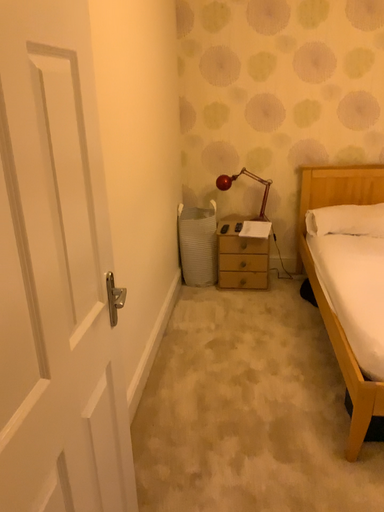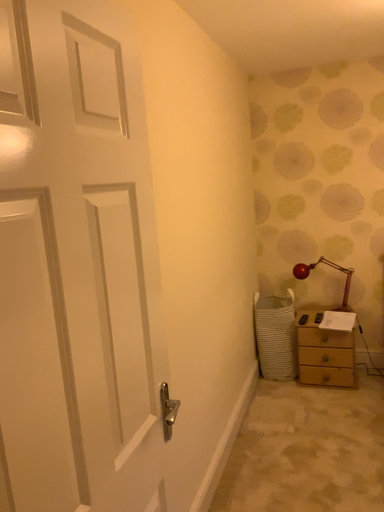
Question: Which way did the camera rotate in the video?

Choices:
 (A) rotated upward
 (B) rotated downward

Answer: (A)